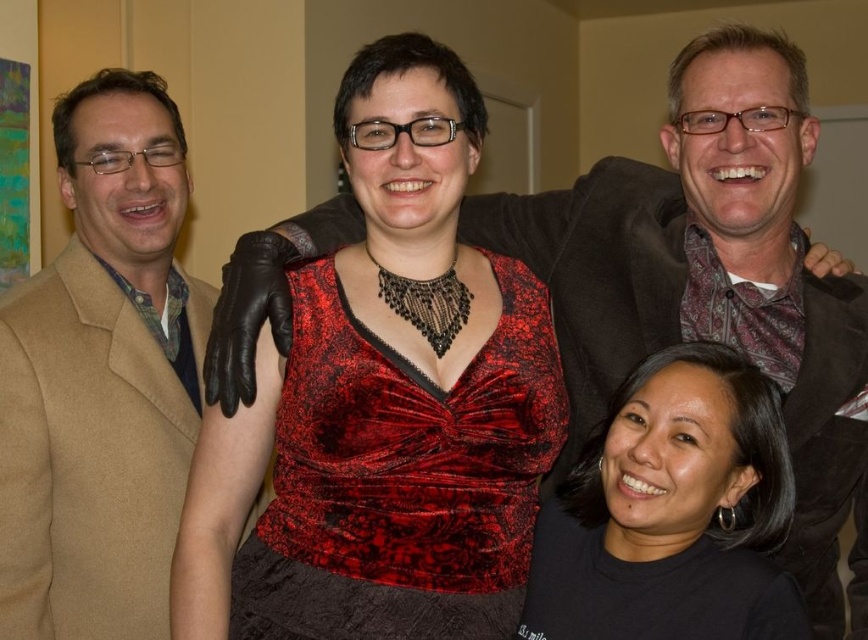
You are at a party and want to take a photo with the matte black jacket at upper right and the black matte shirt at lower right. Which one is higher in the frame?

The matte black jacket at upper right is positioned over the black matte shirt at lower right, so it is higher in the frame.

What is the 2D coordinate of the tan woolen jacket at left?

The tan woolen jacket at left is located at the 2D coordinate point of (102, 378).